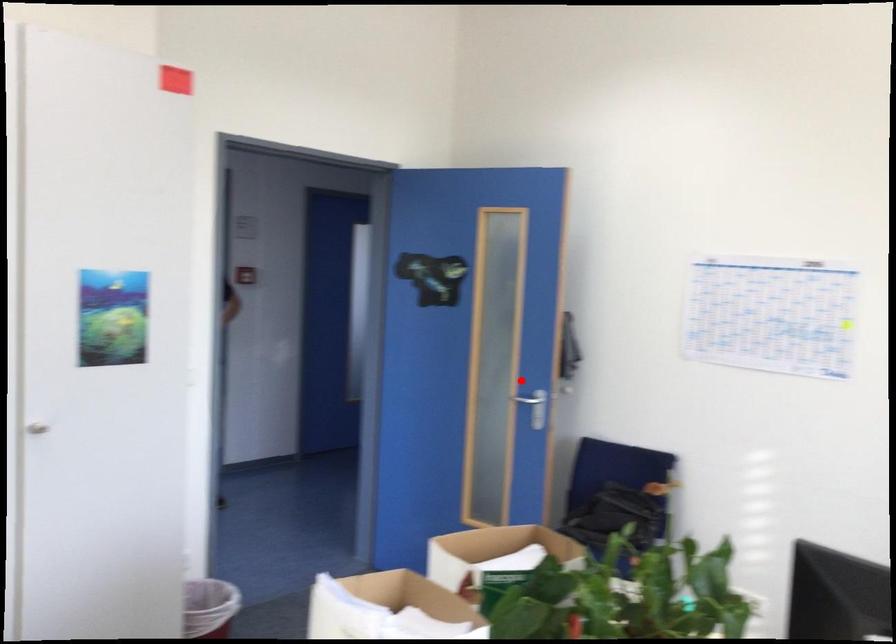
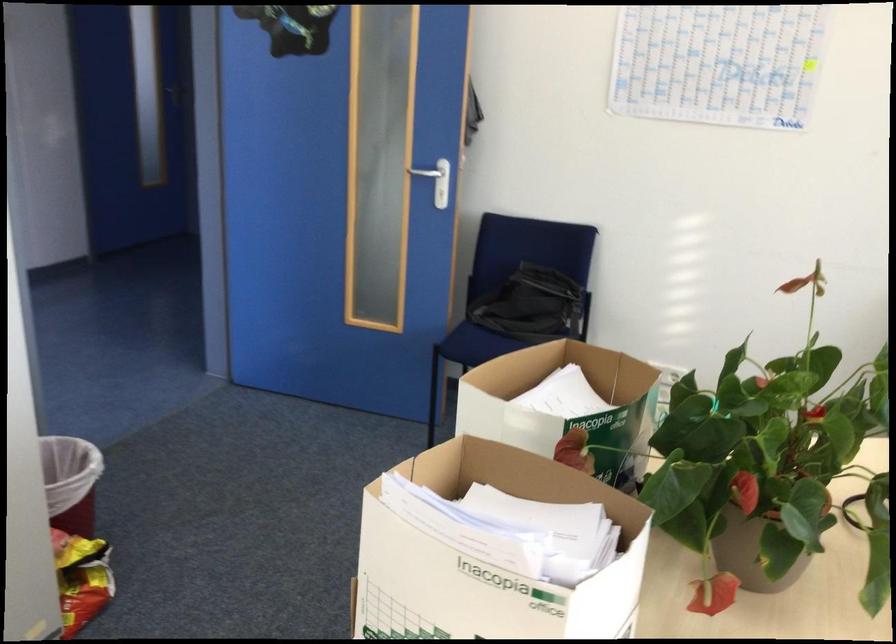
In the second image, find the point that corresponds to the highlighted location in the first image.

(424, 172)